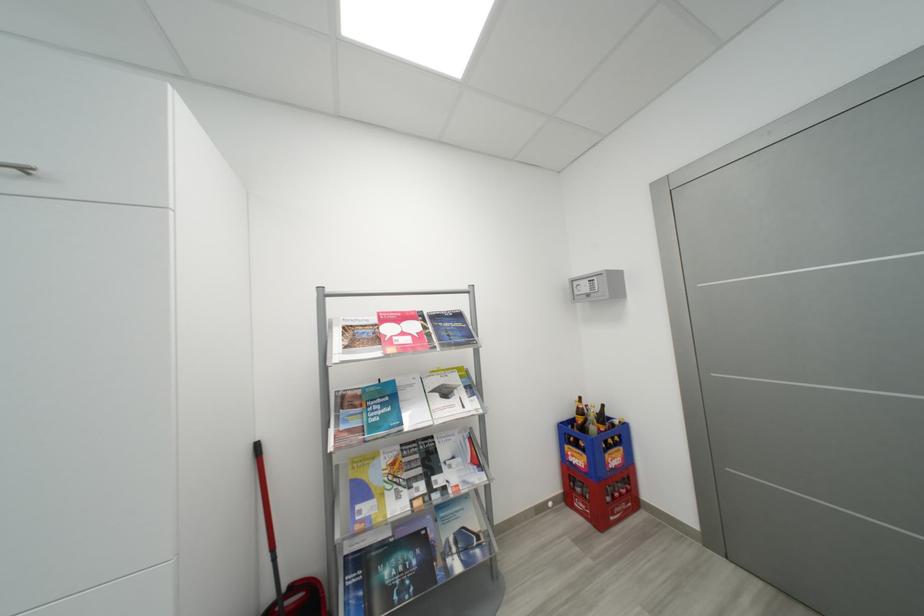
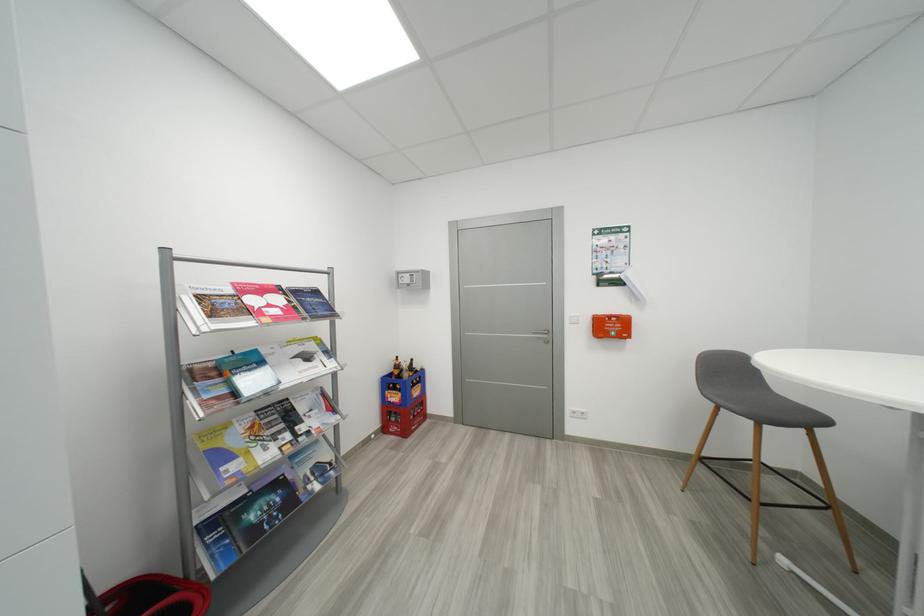
The point at (588, 413) is marked in the first image. Where is the corresponding point in the second image?

(404, 369)